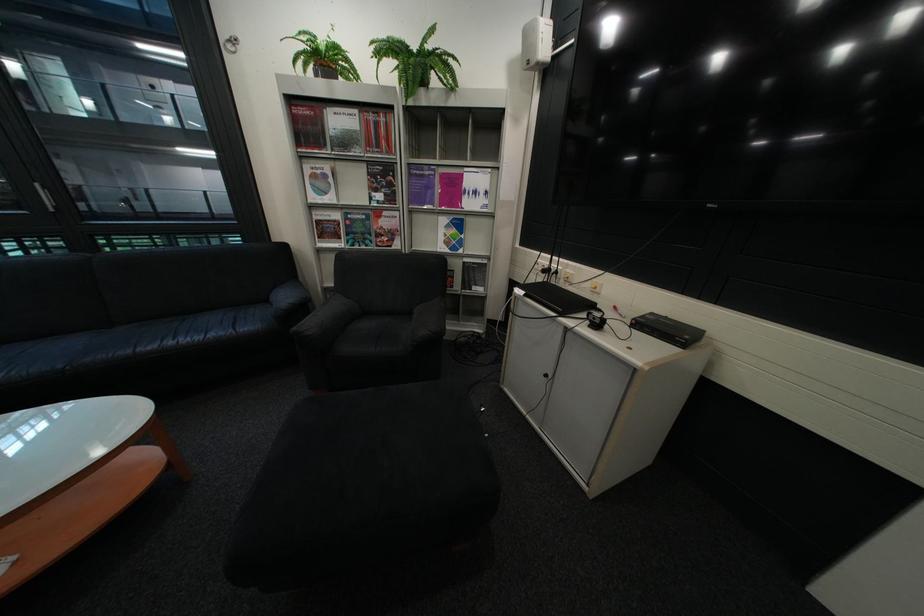
Find the location of a particular element. This screenshot has width=924, height=616. cabinet door handle is located at coordinates (548, 375).